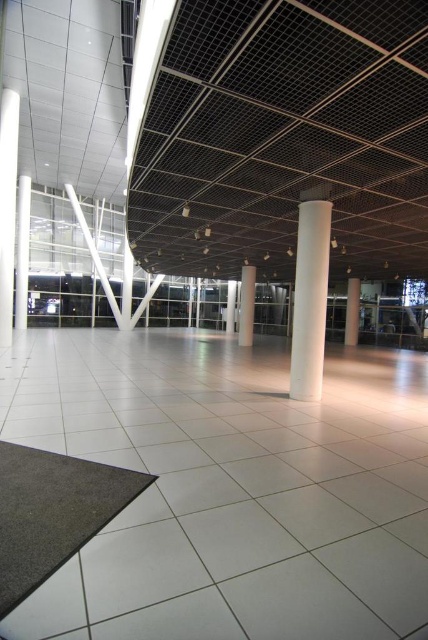
Question: Which of these objects is positioned closest to the white glossy pillar at left?

Choices:
 (A) white glossy pillar at center
 (B) white smooth pillar at center
 (C) dark gray carpet at lower left
 (D) white smooth pillar at right

Answer: (B)

Question: Does white smooth column at center appear on the right side of white smooth pillar at right?

Choices:
 (A) yes
 (B) no

Answer: (B)

Question: Does white glossy pillar at left appear under white smooth pillar at right?

Choices:
 (A) no
 (B) yes

Answer: (A)

Question: Which object appears closest to the camera in this image?

Choices:
 (A) white smooth column at center
 (B) white glossy pillar at left
 (C) white smooth pillar at center
 (D) white glossy pillar at center

Answer: (A)

Question: From the image, what is the correct spatial relationship of white glossy pillar at left in relation to white smooth pillar at center?

Choices:
 (A) below
 (B) above

Answer: (B)

Question: Which point is farther to the camera?

Choices:
 (A) (2, 522)
 (B) (246, 326)
 (C) (303, 300)

Answer: (B)